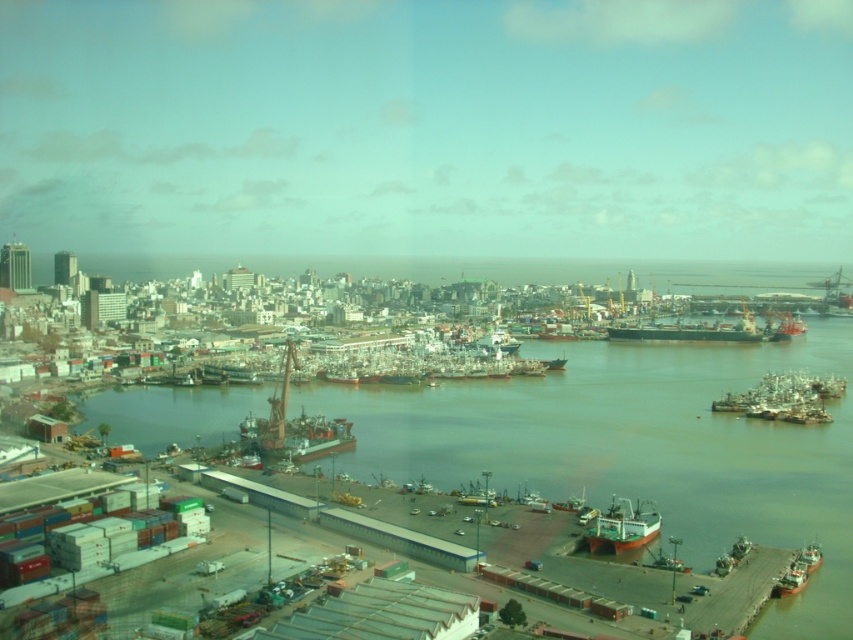
You are a harbor worker who needs to guide a new boat to the docking area. You see the metallic red boat at center and the metallic gray ship at lower right. Which direction should you direct the new boat to dock if it needs to be positioned between them?

The new boat should be directed to dock between the metallic red boat at center and the metallic gray ship at lower right, placing it to the right of the metallic red boat at center and to the left of the metallic gray ship at lower right since the metallic red boat at center is to the left of the metallic gray ship at lower right.

You are standing on the dock and want to board the metallic red boat at center and the metallic gray ship at lower right. Which one will you reach first if you walk straight ahead from your current position?

You will reach the metallic red boat at center first because it is closer to the viewer than the metallic gray ship at lower right.

From the picture: You are standing at the center of the dock area and want to locate the metallic red boat at center. Based on its 2D coordinates, in which direction should you look relative to your current position?

The metallic red boat at center is located at coordinates 0.666 on the x axis and 0.347 on the y axis. Since you are at the center of the dock area, you should look towards the upper right direction to find it.